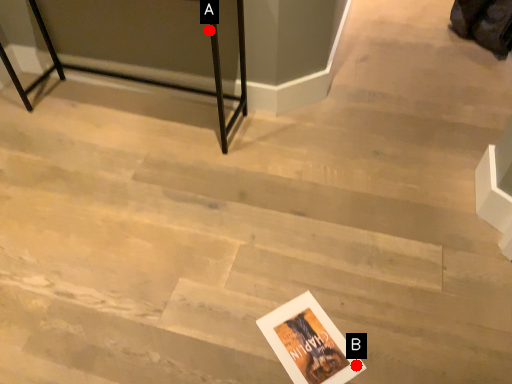
Question: Two points are circled on the image, labeled by A and B beside each circle. Which point is closer to the camera taking this photo?

Choices:
 (A) A is closer
 (B) B is closer

Answer: (B)